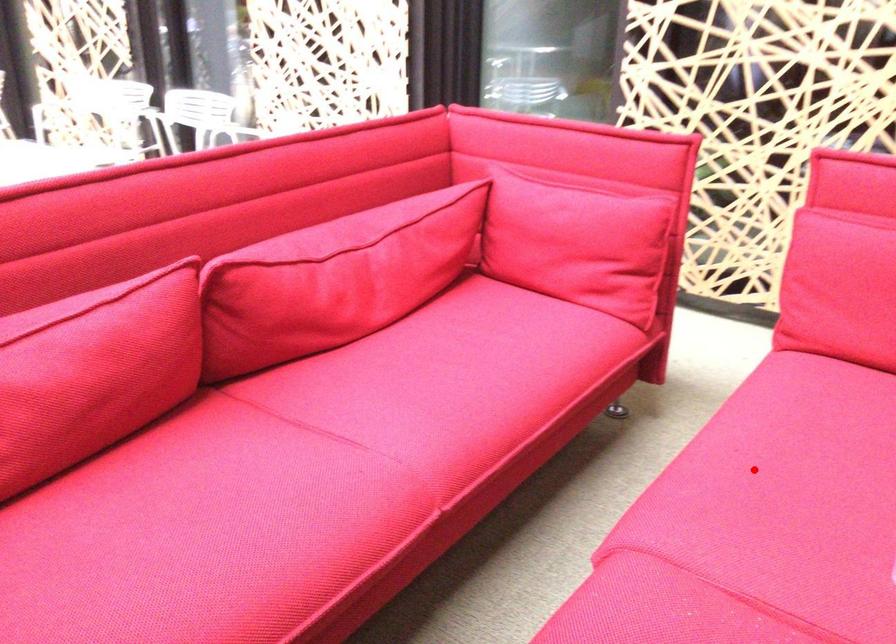
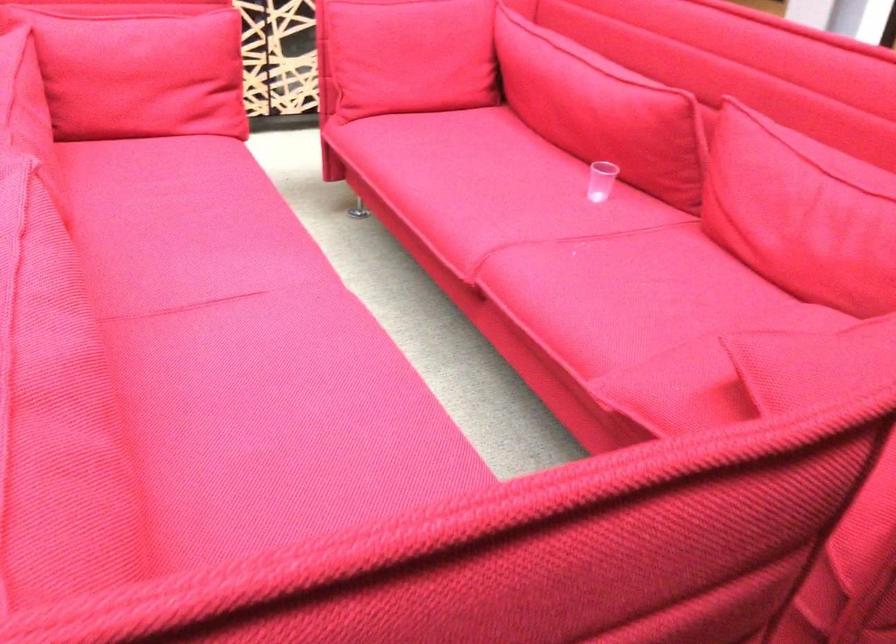
Question: I am providing you with two images of the same scene from different viewpoints. A red point is marked on the first image. Is the red point's position out of view in image 2?

Choices:
 (A) Yes
 (B) No

Answer: (B)